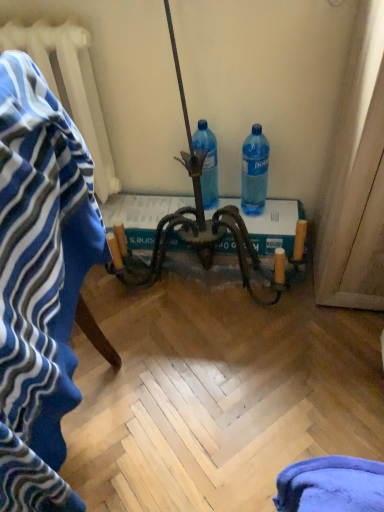
Question: Is blue plastic bottle at center, which is the 2th bottle from right to left, with white textured radiator at upper left?

Choices:
 (A) yes
 (B) no

Answer: (B)

Question: Are blue plastic bottle at center, which is the 2th bottle from right to left, and white textured radiator at upper left far apart?

Choices:
 (A) no
 (B) yes

Answer: (A)

Question: Can you confirm if blue plastic bottle at center, which is the 2th bottle from right to left, is shorter than white textured radiator at upper left?

Choices:
 (A) yes
 (B) no

Answer: (A)

Question: Is blue plastic bottle at center, which is the 2th bottle from right to left, outside white textured radiator at upper left?

Choices:
 (A) yes
 (B) no

Answer: (A)

Question: Is blue plastic bottle at center, which is the 2th bottle from right to left, bigger than white textured radiator at upper left?

Choices:
 (A) no
 (B) yes

Answer: (A)

Question: Does point (82, 181) appear closer or farther from the camera than point (208, 151)?

Choices:
 (A) farther
 (B) closer

Answer: (B)

Question: Relative to blue plastic bottle at center, which is the 2th bottle from right to left, is blue striped bath towel at left in front or behind?

Choices:
 (A) behind
 (B) front

Answer: (B)

Question: Looking at the image, does blue striped bath towel at left seem bigger or smaller compared to blue plastic bottle at center, which is counted as the first bottle, starting from the left?

Choices:
 (A) small
 (B) big

Answer: (B)

Question: Choose the correct answer: Is blue striped bath towel at left inside blue plastic bottle at center, which is counted as the first bottle, starting from the left, or outside it?

Choices:
 (A) inside
 (B) outside

Answer: (B)

Question: Is white textured radiator at upper left situated inside blue plastic bottle at center, which is the 2th bottle from right to left, or outside?

Choices:
 (A) inside
 (B) outside

Answer: (B)

Question: Considering the positions of white textured radiator at upper left and blue plastic bottle at center, which is the 2th bottle from right to left, in the image, is white textured radiator at upper left taller or shorter than blue plastic bottle at center, which is the 2th bottle from right to left,?

Choices:
 (A) tall
 (B) short

Answer: (A)

Question: Considering the positions of white textured radiator at upper left and blue plastic bottle at center, which is counted as the first bottle, starting from the left, in the image, is white textured radiator at upper left bigger or smaller than blue plastic bottle at center, which is counted as the first bottle, starting from the left,?

Choices:
 (A) small
 (B) big

Answer: (B)

Question: Is white textured radiator at upper left to the left or to the right of blue plastic bottle at center, which is the 2th bottle from right to left, in the image?

Choices:
 (A) left
 (B) right

Answer: (A)

Question: In the image, is blue plastic bottle at center, which is counted as the first bottle, starting from the left, on the left side or the right side of white textured radiator at upper left?

Choices:
 (A) right
 (B) left

Answer: (A)

Question: From a real-world perspective, relative to white textured radiator at upper left, is blue plastic bottle at center, which is the 2th bottle from right to left, vertically above or below?

Choices:
 (A) below
 (B) above

Answer: (A)